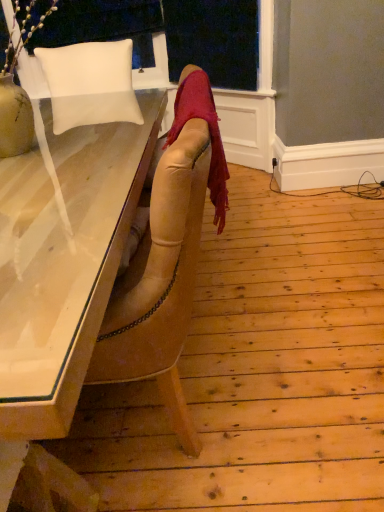
Question: Considering their positions, is white leather chair at upper left located in front of or behind velvet red scarf at center?

Choices:
 (A) behind
 (B) front

Answer: (A)

Question: Is white leather chair at upper left spatially inside velvet red scarf at center, or outside of it?

Choices:
 (A) inside
 (B) outside

Answer: (B)

Question: Estimate the real-world distances between objects in this image. Which object is closer to the white leather chair at upper left?

Choices:
 (A) matte wooden desk at left
 (B) velvet red scarf at center
 (C) white matte pillow at upper left

Answer: (C)

Question: Estimate the real-world distances between objects in this image. Which object is farther from the white matte pillow at upper left?

Choices:
 (A) velvet red scarf at center
 (B) white leather chair at upper left
 (C) matte wooden desk at left

Answer: (A)